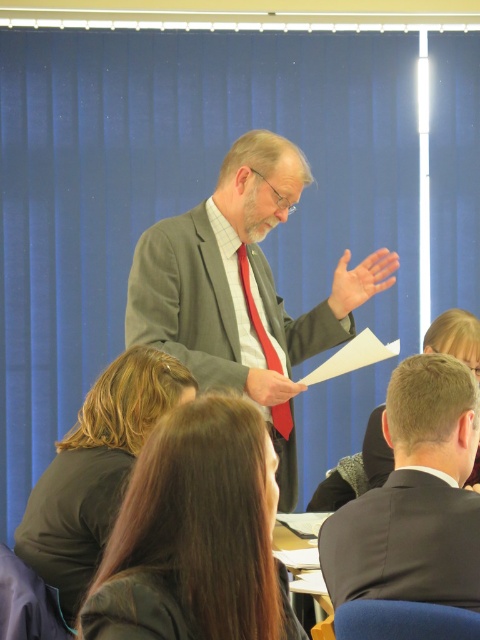
Question: Which of the following is the farthest from the observer?

Choices:
 (A) (397, 266)
 (B) (251, 323)
 (C) (256, 212)
 (D) (45, 515)

Answer: (A)

Question: Which object appears closest to the camera in this image?

Choices:
 (A) dark green fabric business suit at lower left
 (B) dark gray suit at center
 (C) brown hair at center
 (D) matte red tie at center

Answer: (C)

Question: Does brown hair at center have a smaller size compared to dark gray suit at center?

Choices:
 (A) yes
 (B) no

Answer: (A)

Question: Which point is farther to the camera?

Choices:
 (A) (287, 140)
 (B) (294, 392)
 (C) (436, 371)

Answer: (A)

Question: From the image, what is the correct spatial relationship of matte gray suit at center in relation to dark green fabric business suit at lower left?

Choices:
 (A) below
 (B) above

Answer: (B)

Question: Does dark green fabric business suit at lower left have a larger size compared to matte red tie at center?

Choices:
 (A) yes
 (B) no

Answer: (A)